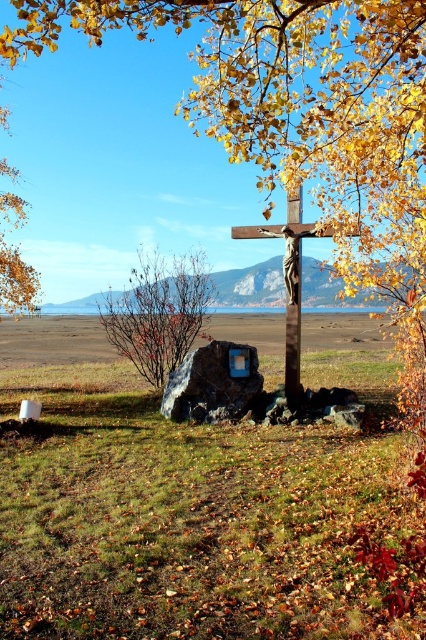
Is rusty metal sign at center smaller than metallic brown cross at center?

Yes.

Measure the distance between rusty metal sign at center and camera.

A: rusty metal sign at center is 31.45 feet from camera.

What do you see at coordinates (213, 384) in the screenshot?
I see `rusty metal sign at center` at bounding box center [213, 384].

Locate an element on the screen. The height and width of the screenshot is (640, 426). rusty metal sign at center is located at coordinates (213, 384).

Is bare branches at center closer to the viewer compared to metallic brown cross at center?

No, bare branches at center is behind metallic brown cross at center.

From the picture: Does bare branches at center appear under metallic brown cross at center?

Indeed, bare branches at center is positioned under metallic brown cross at center.

Who is more forward, (143, 358) or (293, 227)?

Point (293, 227) is more forward.

The height and width of the screenshot is (640, 426). Identify the location of bare branches at center. (158, 314).

How distant is bare branches at center from rusty metal sign at center?

They are 8.42 feet apart.

Between bare branches at center and rusty metal sign at center, which one appears on the left side from the viewer's perspective?

Positioned to the left is bare branches at center.

Identify the location of bare branches at center. Image resolution: width=426 pixels, height=640 pixels. (158, 314).